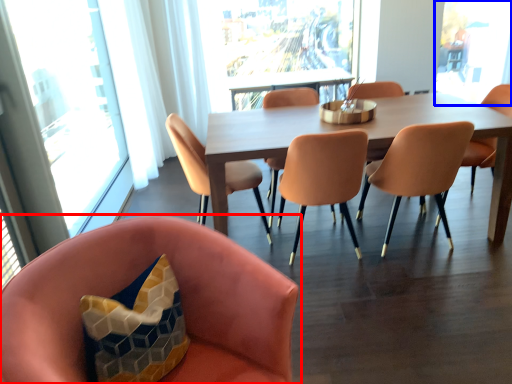
Question: Among these objects, which one is farthest to the camera, chair (highlighted by a red box) or window screen (highlighted by a blue box)?

Choices:
 (A) chair
 (B) window screen

Answer: (B)